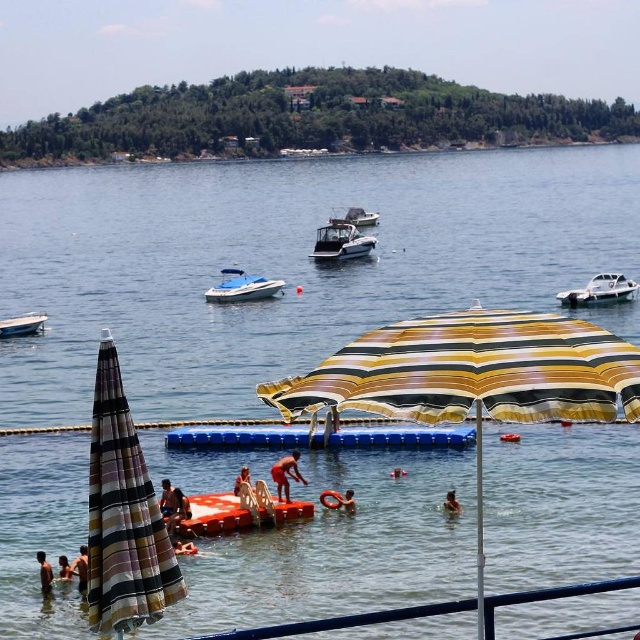
Which is more to the left, white plastic boat at center or orange fabric towel at center?

From the viewer's perspective, orange fabric towel at center appears more on the left side.

I want to click on white plastic boat at center, so click(356, 218).

Between point (374, 218) and point (236, 480), which one is positioned behind?

Point (374, 218)

At what (x,y) coordinates should I click in order to perform the action: click on white plastic boat at center. Please return your answer as a coordinate pair (x, y). Looking at the image, I should click on (356, 218).

Does yellow striped umbrella at center come behind white glossy boat at right?

No, yellow striped umbrella at center is closer to the viewer.

Is yellow striped umbrella at center to the right of white glossy boat at right from the viewer's perspective?

Incorrect, yellow striped umbrella at center is not on the right side of white glossy boat at right.

Is point (604, 365) positioned in front of point (570, 300)?

Yes.

Locate an element on the screen. This screenshot has height=640, width=640. yellow striped umbrella at center is located at coordinates (472, 378).

Who is higher up, white glossy boat at left or white plastic boat at center?

white plastic boat at center

Does white glossy boat at left have a lesser width compared to white plastic boat at center?

Correct, white glossy boat at left's width is less than white plastic boat at center's.

At what (x,y) coordinates should I click in order to perform the action: click on white glossy boat at left. Please return your answer as a coordinate pair (x, y). This screenshot has height=640, width=640. Looking at the image, I should click on [x=20, y=324].

Where is `white glossy boat at left`? white glossy boat at left is located at coordinates (20, 324).